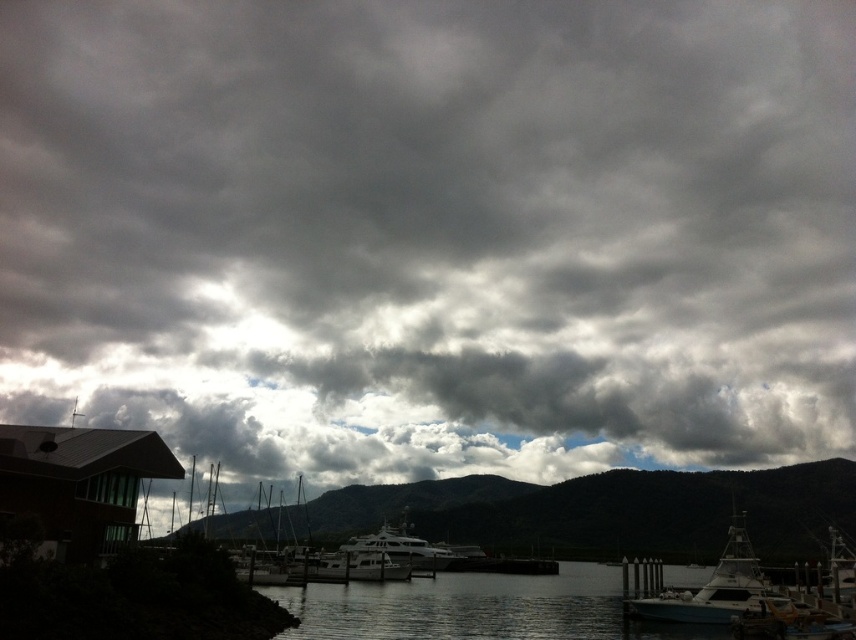
Does white glossy boat at lower right have a greater width compared to metallic silver yacht at center?

Correct, the width of white glossy boat at lower right exceeds that of metallic silver yacht at center.

Is white glossy boat at lower right shorter than metallic silver yacht at center?

Incorrect, white glossy boat at lower right's height does not fall short of metallic silver yacht at center's.

Is point (759, 600) in front of point (292, 570)?

Yes, it is.

Identify the location of white glossy boat at lower right. The image size is (856, 640). (709, 588).

Which is above, white glossy boat at lower right or white glossy yacht at center?

white glossy yacht at center

Does white glossy boat at lower right have a greater width compared to white glossy yacht at center?

Yes, white glossy boat at lower right is wider than white glossy yacht at center.

Does point (744, 596) come behind point (417, 547)?

That is False.

This screenshot has width=856, height=640. What are the coordinates of `white glossy boat at lower right` in the screenshot? It's located at click(709, 588).

Is metallic silver yacht at center taller than white glossy yacht at center?

In fact, metallic silver yacht at center may be shorter than white glossy yacht at center.

Which is behind, point (331, 563) or point (400, 560)?

The point (400, 560) is more distant.

What do you see at coordinates (349, 566) in the screenshot? I see `metallic silver yacht at center` at bounding box center [349, 566].

The image size is (856, 640). I want to click on metallic silver yacht at center, so click(x=349, y=566).